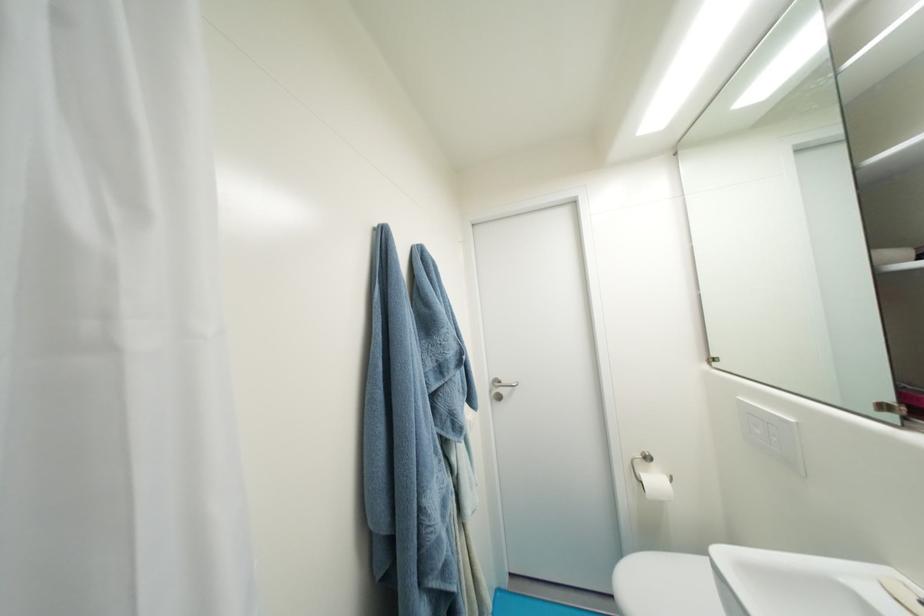
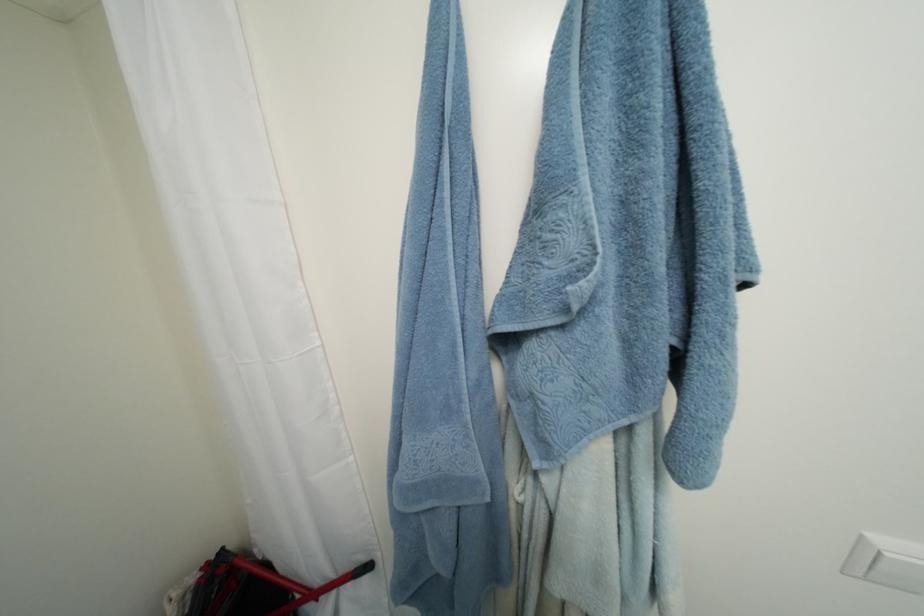
The first image is from the beginning of the video and the second image is from the end. How did the camera likely rotate when shooting the video?

A: The camera rotated toward left-down.